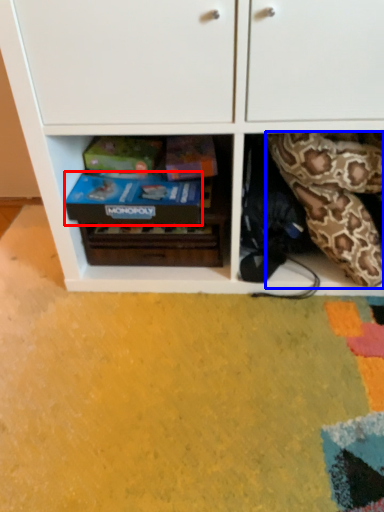
Question: Which of the following is the closest to the observer, shoe box (highlighted by a red box) or snake (highlighted by a blue box)?

Choices:
 (A) shoe box
 (B) snake

Answer: (B)